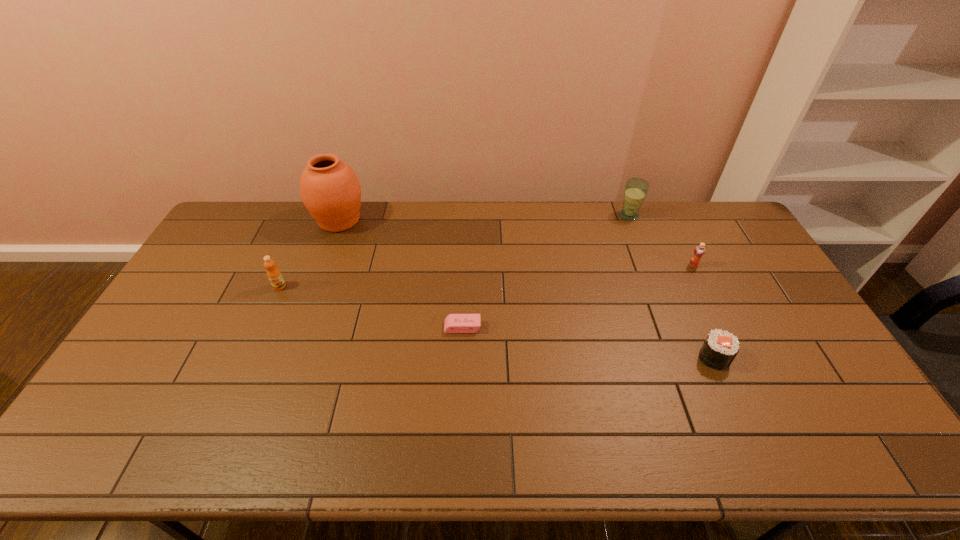
You are a GUI agent. You are given a task and a screenshot of the screen. Output one action in this format:
    pyautogui.click(x=<x>, y=<y>)
    Task: Click on the free space located on the right of the tallest object
    
    Given the screenshot: What is the action you would take?
    pyautogui.click(x=398, y=220)

At what (x,y) coordinates should I click in order to perform the action: click on free space located 0.270m on the left of the glass. Please return your answer as a coordinate pair (x, y). Looking at the image, I should click on (547, 215).

Locate an element on the screen. Image resolution: width=960 pixels, height=540 pixels. vacant space located 0.310m on the front label of the taller orange juice is located at coordinates (240, 375).

Identify the location of free point located on the right of the shorter orange juice. The image size is (960, 540). (745, 266).

Identify the location of free point located on the right of the sushi. The image size is (960, 540). (805, 357).

In order to click on vacant area situated on the right of the fifth farthest object in this screenshot , I will do `click(539, 327)`.

Image resolution: width=960 pixels, height=540 pixels. Identify the location of urn present at the far edge. (330, 190).

This screenshot has height=540, width=960. What are the coordinates of `glass that is positioned at the far edge` in the screenshot? It's located at (635, 191).

Where is `free space at the far edge of the desktop`? This screenshot has height=540, width=960. free space at the far edge of the desktop is located at coordinates (516, 205).

In the image, there is a desktop. Where is `vacant space at the near edge`? vacant space at the near edge is located at coordinates (648, 458).